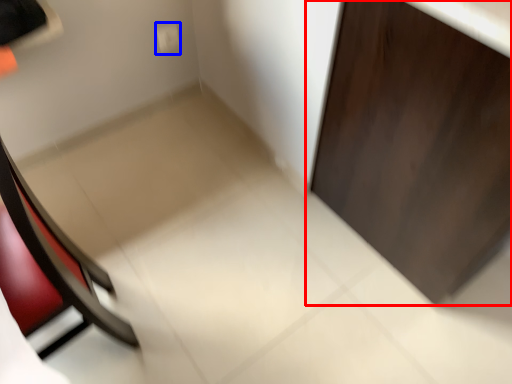
Question: Which point is further to the camera, door (highlighted by a red box) or electric outlet (highlighted by a blue box)?

Choices:
 (A) door
 (B) electric outlet

Answer: (B)